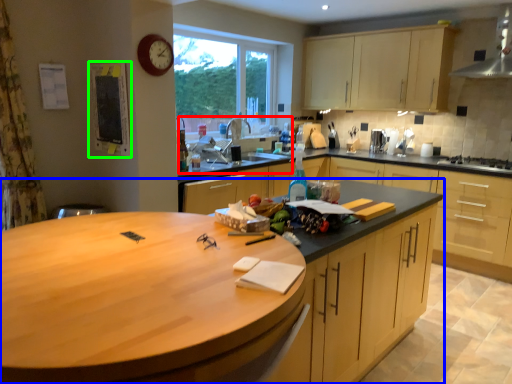
Question: Considering the real-world distances, which object is closest to sink (highlighted by a red box)? countertop (highlighted by a blue box) or bulletin board (highlighted by a green box).

Choices:
 (A) countertop
 (B) bulletin board

Answer: (B)